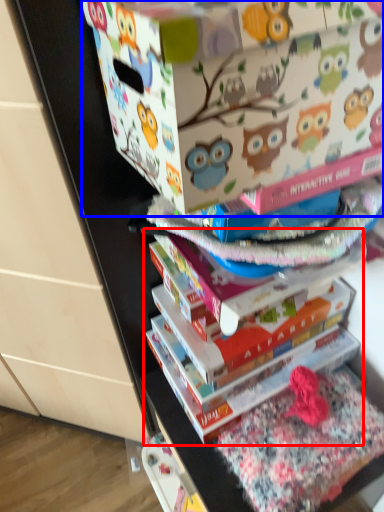
Question: Which object appears closest to the camera in this image, book (highlighted by a red box) or cardboard box (highlighted by a blue box)?

Choices:
 (A) book
 (B) cardboard box

Answer: (B)